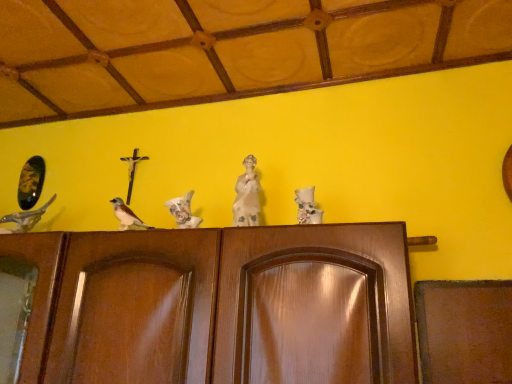
Question: Is white porcelain statue at center surrounding brown matte bird at center, the second bird from the right?

Choices:
 (A) no
 (B) yes

Answer: (A)

Question: Does white porcelain statue at center have a greater height compared to brown matte bird at center, the 2th bird positioned from the left?

Choices:
 (A) yes
 (B) no

Answer: (A)

Question: Does white porcelain statue at center have a lesser height compared to brown matte bird at center, the 2th bird positioned from the left?

Choices:
 (A) yes
 (B) no

Answer: (B)

Question: Would you say white porcelain statue at center is a long distance from brown matte bird at center, the second bird from the right?

Choices:
 (A) no
 (B) yes

Answer: (A)

Question: From the image's perspective, is white porcelain statue at center beneath brown matte bird at center, the 2th bird positioned from the left?

Choices:
 (A) yes
 (B) no

Answer: (B)

Question: Is white porcelain statue at center oriented away from brown matte bird at center, the second bird from the right?

Choices:
 (A) no
 (B) yes

Answer: (A)

Question: Is shiny metallic bird at left, the third bird from the right, located outside brown matte bird at center, the 2th bird positioned from the left?

Choices:
 (A) yes
 (B) no

Answer: (A)

Question: Is shiny metallic bird at left, the third bird from the right, surrounding brown matte bird at center, the 2th bird positioned from the left?

Choices:
 (A) no
 (B) yes

Answer: (A)

Question: From a real-world perspective, does shiny metallic bird at left, the third bird from the right, sit lower than brown matte bird at center, the second bird from the right?

Choices:
 (A) yes
 (B) no

Answer: (B)

Question: Is brown matte bird at center, the 2th bird positioned from the left, at the back of shiny metallic bird at left, the third bird from the right?

Choices:
 (A) no
 (B) yes

Answer: (A)

Question: Could you tell me if shiny metallic bird at left, which is the first bird from left to right, is facing brown matte bird at center, the second bird from the right?

Choices:
 (A) no
 (B) yes

Answer: (A)

Question: Does shiny metallic bird at left, which is the first bird from left to right, have a smaller size compared to brown matte bird at center, the second bird from the right?

Choices:
 (A) yes
 (B) no

Answer: (B)

Question: Is the surface of brown matte bird at center, the second bird from the right, in direct contact with white porcelain statue at center?

Choices:
 (A) no
 (B) yes

Answer: (A)